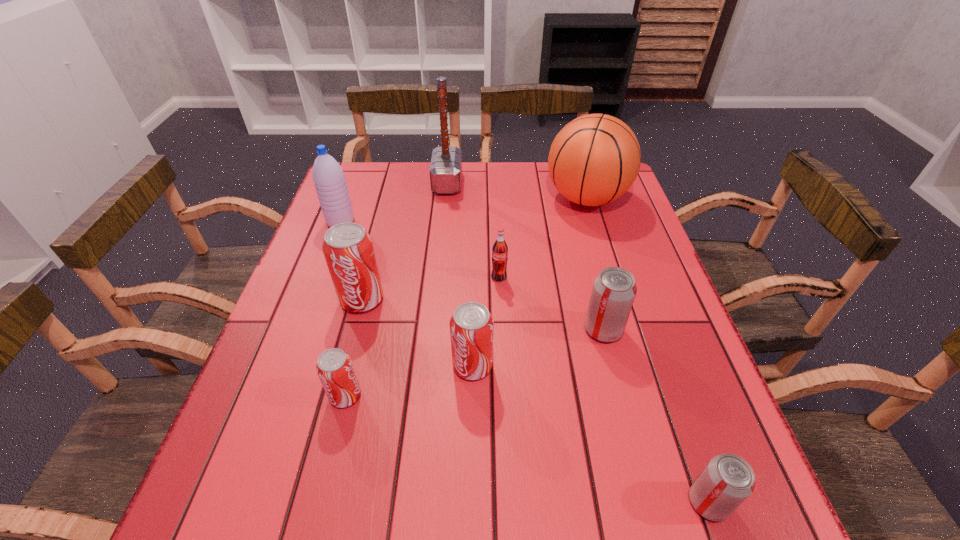
Locate an element on the screen. object located at the far right corner is located at coordinates (594, 159).

Where is `object that is at the near right corner`? The height and width of the screenshot is (540, 960). object that is at the near right corner is located at coordinates (728, 480).

Where is `vacant space at the far edge of the desktop`? This screenshot has height=540, width=960. vacant space at the far edge of the desktop is located at coordinates (562, 196).

I want to click on free space at the left edge, so click(300, 395).

Find the location of a particular element. free spot at the right edge of the desktop is located at coordinates (636, 261).

Identify the location of vacant position at the far left corner of the desktop. (389, 177).

This screenshot has height=540, width=960. What are the coordinates of `vacant area that lies between the smallest red soda can and the basketball` in the screenshot? It's located at (466, 297).

Find the location of `vacant area that lies between the nearest object and the third soda can from right to left`. vacant area that lies between the nearest object and the third soda can from right to left is located at coordinates (604, 390).

Locate an element on the screen. free space that is in between the farthest soda can and the smallest red soda can is located at coordinates (422, 337).

You are a GUI agent. You are given a task and a screenshot of the screen. Output one action in this format:
    pyautogui.click(x=<x>, y=<y>)
    Task: Click on the free spot between the sixth nearest object and the blue water bottle
    Image resolution: width=960 pixels, height=540 pixels.
    Given the screenshot: What is the action you would take?
    pyautogui.click(x=420, y=250)